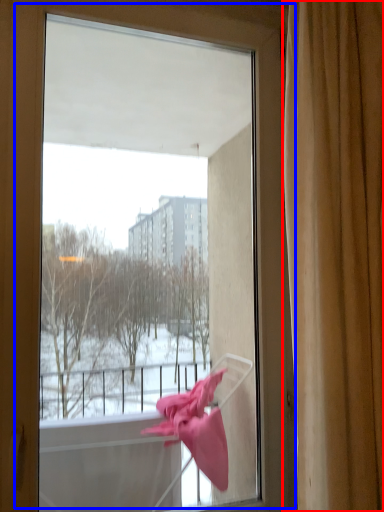
Question: Which of the following is the closest to the observer, curtain (highlighted by a red box) or window (highlighted by a blue box)?

Choices:
 (A) curtain
 (B) window

Answer: (A)